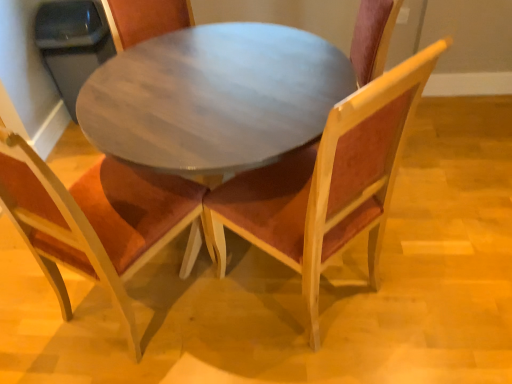
Question: From a real-world perspective, is velvet burgundy chair at center, arranged as the first chair when viewed from the right, above or below wooden round table at center?

Choices:
 (A) above
 (B) below

Answer: (A)

Question: Is velvet burgundy chair at center, placed as the second chair when sorted from left to right, to the left or to the right of wooden round table at center in the image?

Choices:
 (A) left
 (B) right

Answer: (B)

Question: Considering the real-world distances, which object is farthest from the wooden round table at center?

Choices:
 (A) velvet burgundy chair at center, arranged as the first chair when viewed from the right
 (B) wooden chair with orange cushion at center, which ranks as the second chair in right-to-left order

Answer: (B)

Question: Which of these objects is positioned closest to the wooden chair with orange cushion at center, which ranks as the second chair in right-to-left order?

Choices:
 (A) velvet burgundy chair at center, arranged as the first chair when viewed from the right
 (B) wooden round table at center

Answer: (B)